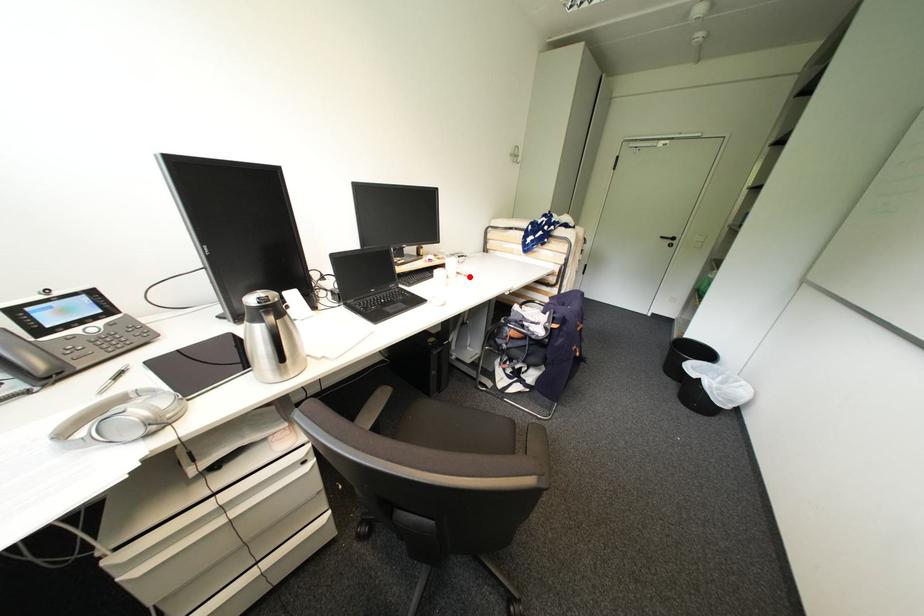
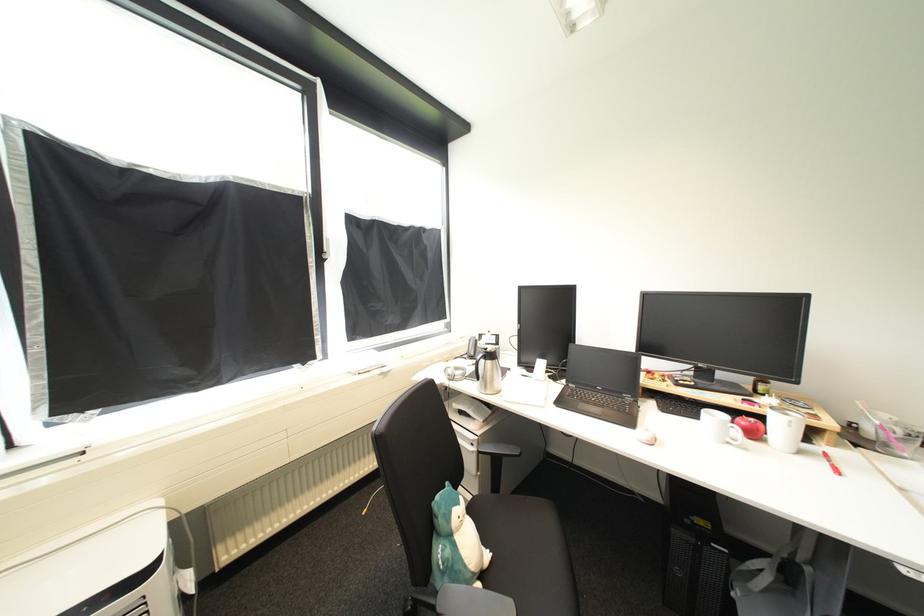
Find the pixel in the second image that matches the highlighted location in the first image.

(834, 464)